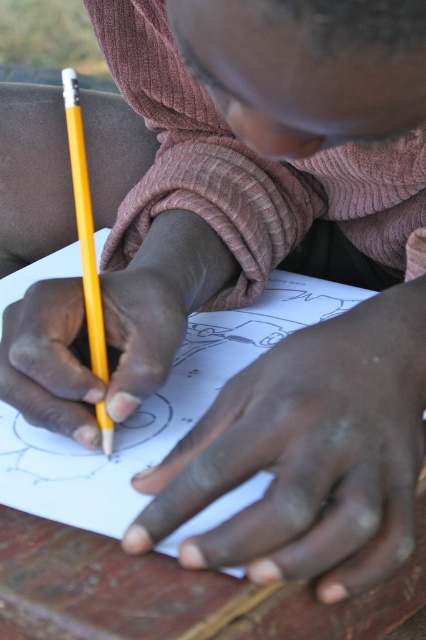
Which is more to the right, smooth yellow pencil at center or yellow wood pencil at lower left?

Positioned to the right is smooth yellow pencil at center.

Between point (172, 324) and point (83, 252), which one is positioned in front?

Point (83, 252) is in front.

Locate an element on the screen. The height and width of the screenshot is (640, 426). smooth yellow pencil at center is located at coordinates (78, 348).

Does dry skin at center appear under yellow wood pencil at lower left?

Correct, dry skin at center is located below yellow wood pencil at lower left.

Which is more to the left, dry skin at center or yellow wood pencil at lower left?

yellow wood pencil at lower left

This screenshot has width=426, height=640. What do you see at coordinates (307, 456) in the screenshot?
I see `dry skin at center` at bounding box center [307, 456].

Where is `dry skin at center`? The image size is (426, 640). dry skin at center is located at coordinates (307, 456).

Does dry skin at center appear over smooth yellow pencil at center?

Incorrect, dry skin at center is not positioned above smooth yellow pencil at center.

Which is in front, point (389, 497) or point (115, 417)?

Point (389, 497)

Who is more distant from viewer, [233,392] or [181,289]?

Point [181,289]

Identify the location of dry skin at center. (307, 456).